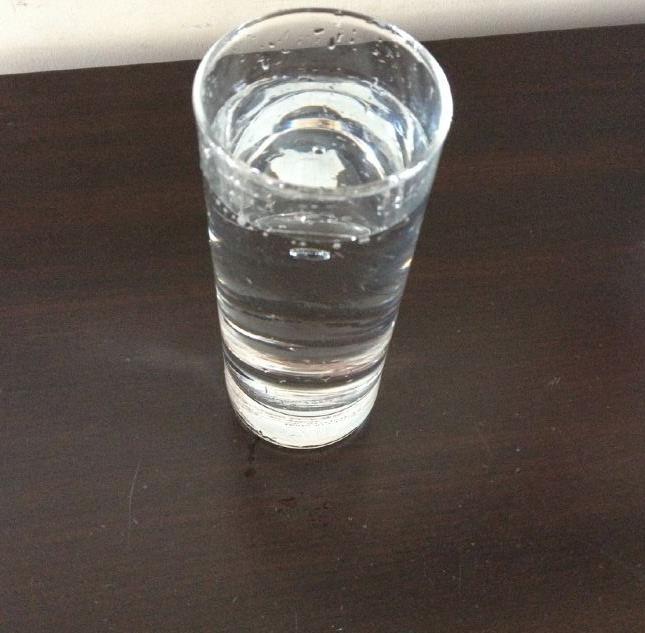
This screenshot has height=633, width=645. I want to click on table, so click(x=509, y=306), click(x=97, y=323), click(x=346, y=549).